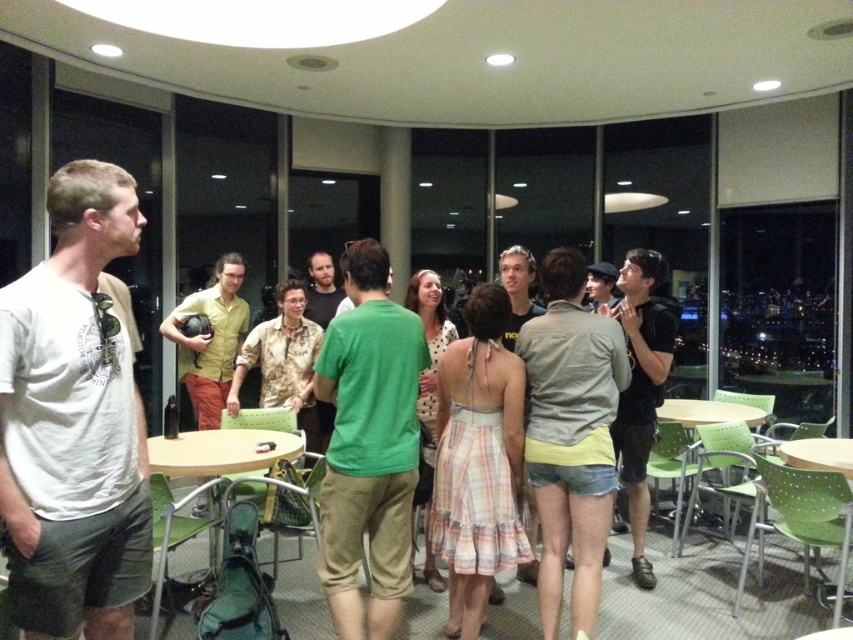
Is black matte shirt at right above wooden table at center?

Correct, black matte shirt at right is located above wooden table at center.

This screenshot has width=853, height=640. I want to click on black matte shirt at right, so click(x=640, y=388).

What do you see at coordinates (640, 388) in the screenshot?
I see `black matte shirt at right` at bounding box center [640, 388].

This screenshot has width=853, height=640. I want to click on black matte shirt at right, so click(x=640, y=388).

Is white cotton t-shirt at left to the right of green plastic table at lower right from the viewer's perspective?

Incorrect, white cotton t-shirt at left is not on the right side of green plastic table at lower right.

Which is in front, point (113, 589) or point (714, 403)?

Point (113, 589) is in front.

Where is `white cotton t-shirt at left`? white cotton t-shirt at left is located at coordinates (73, 420).

Does point (373, 435) come in front of point (209, 483)?

Yes.

Who is positioned more to the left, green matte shirt at center or wooden table at center?

Positioned to the left is wooden table at center.

Find the location of a particular element. green matte shirt at center is located at coordinates (369, 445).